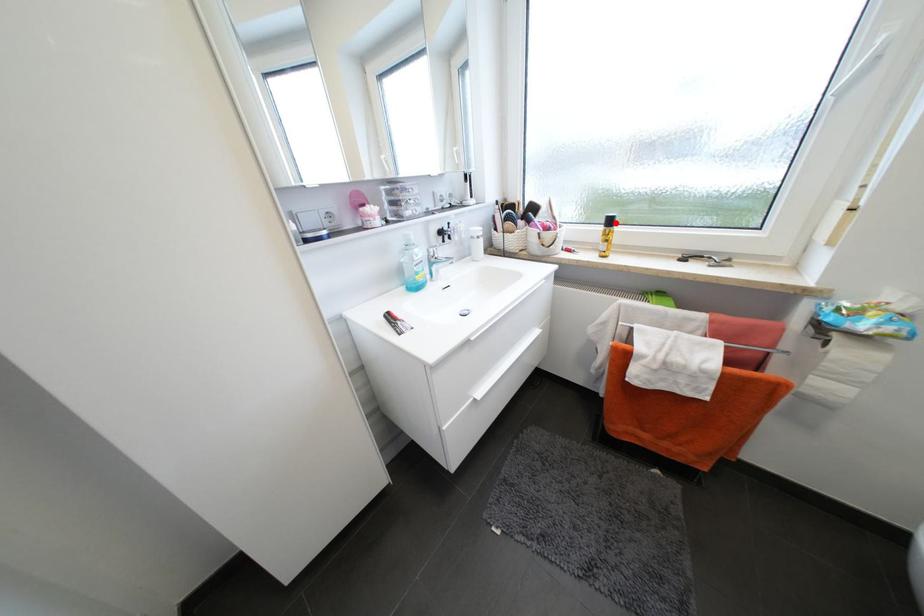
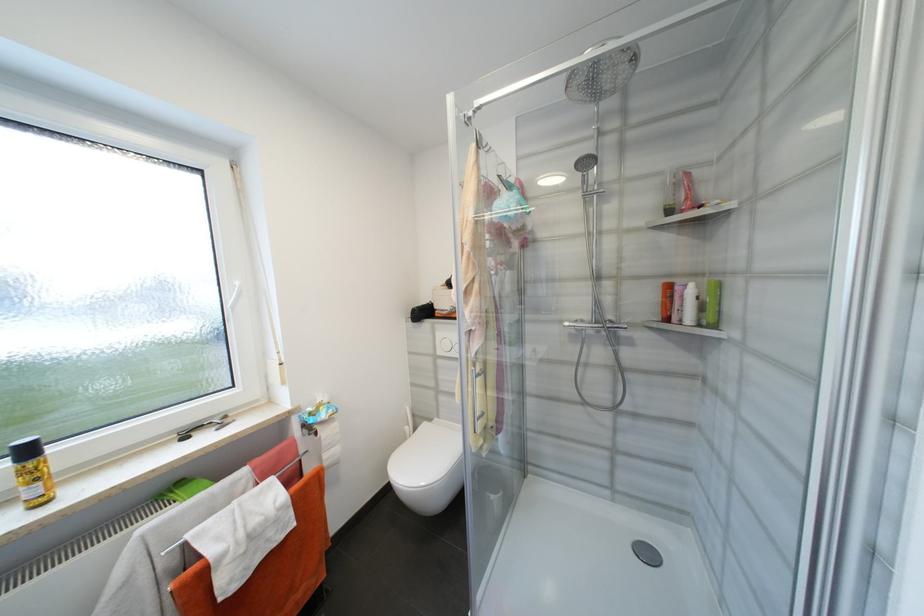
Where in the second image is the point corresponding to the highlighted location from the first image?

(33, 453)